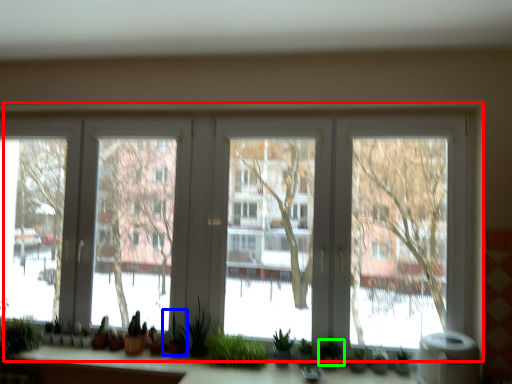
Question: Which object is positioned farthest from window (highlighted by a red box)? Select from plant (highlighted by a blue box) and plant (highlighted by a green box).

Choices:
 (A) plant
 (B) plant

Answer: (B)